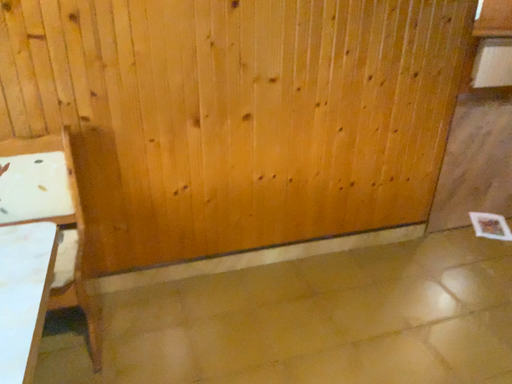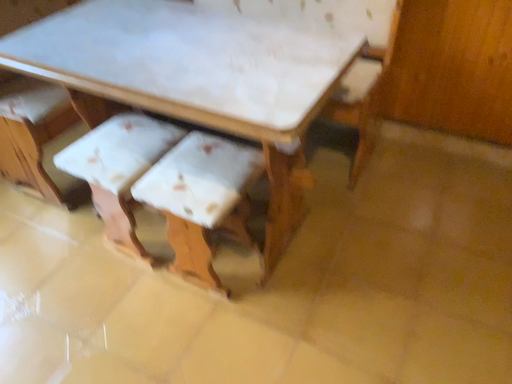
Question: Which way did the camera rotate in the video?

Choices:
 (A) rotated left
 (B) rotated right

Answer: (A)